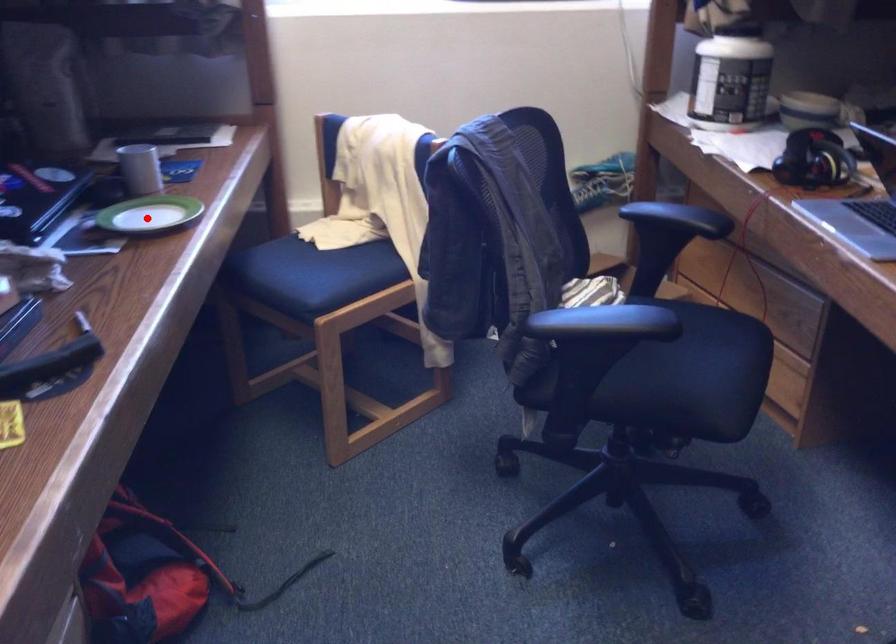
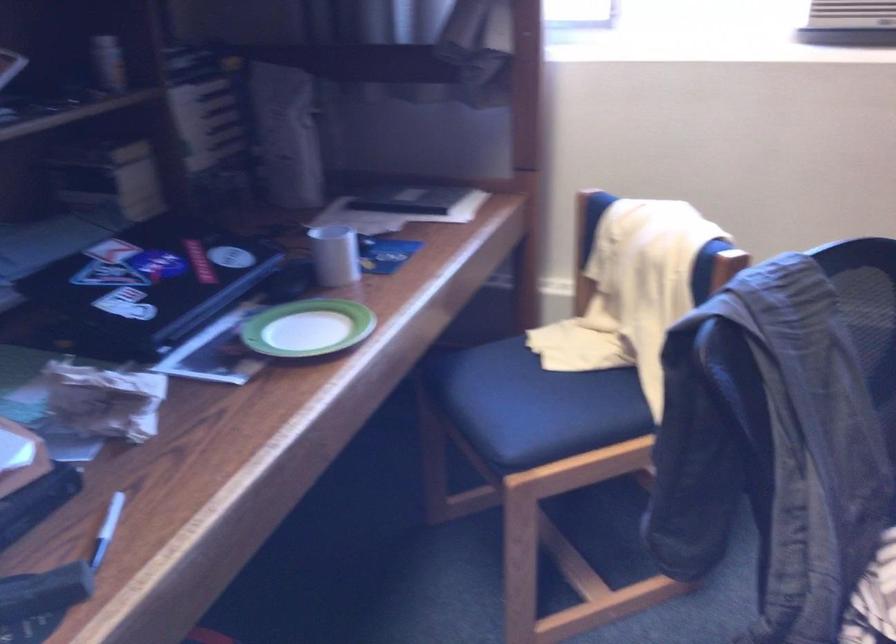
In the second image, find the point that corresponds to the highlighted location in the first image.

(307, 328)